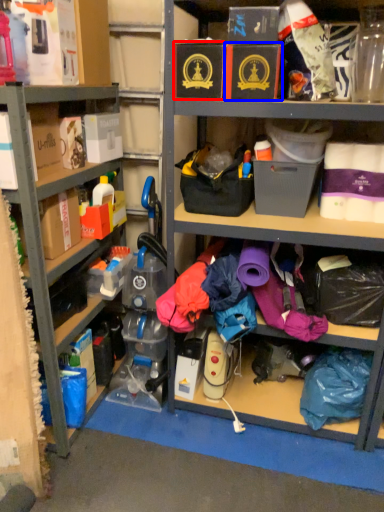
Question: Which point is closer to the camera, storage box (highlighted by a red box) or storage box (highlighted by a blue box)?

Choices:
 (A) storage box
 (B) storage box

Answer: (B)